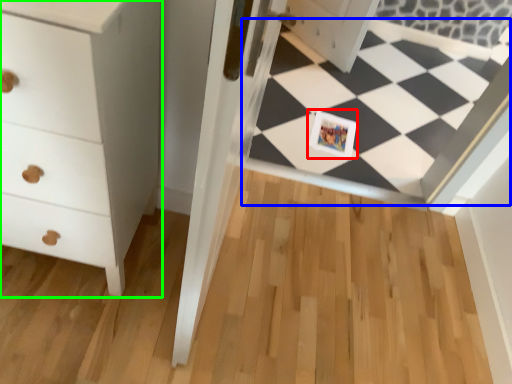
Question: Which object is positioned closest to postcard (highlighted by a red box)? Select from square (highlighted by a blue box) and chest of drawers (highlighted by a green box).

Choices:
 (A) square
 (B) chest of drawers

Answer: (A)